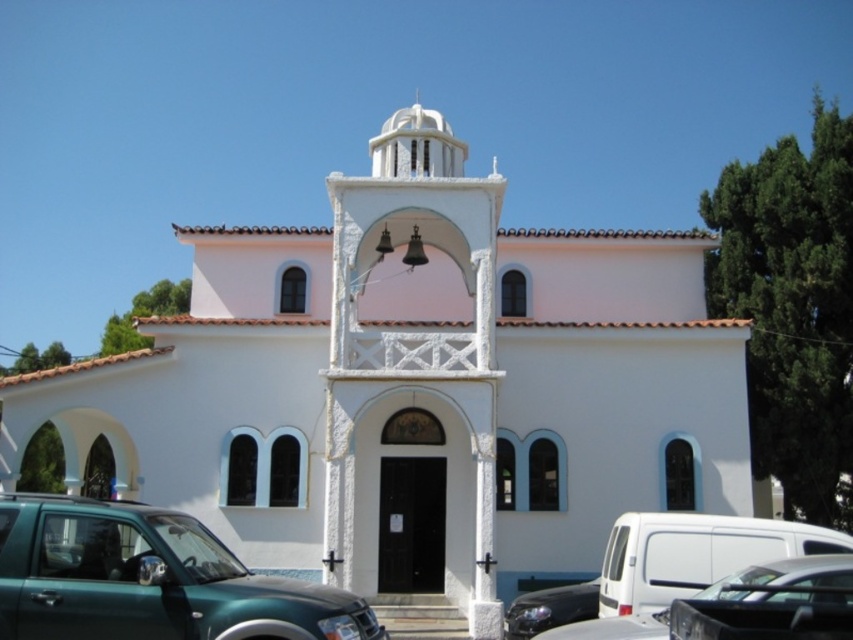
Looking at this image, can you confirm if green matte truck at lower left is positioned below black glossy car at lower right?

Yes, green matte truck at lower left is below black glossy car at lower right.

Based on the photo, who is lower down, green matte truck at lower left or black glossy car at lower right?

green matte truck at lower left

This screenshot has width=853, height=640. I want to click on green matte truck at lower left, so (x=148, y=579).

Find the location of a particular element. green matte truck at lower left is located at coordinates (148, 579).

The image size is (853, 640). Describe the element at coordinates (415, 342) in the screenshot. I see `white stone bell tower at center` at that location.

Is white stone bell tower at center closer to the viewer compared to black glossy car at lower right?

That is False.

Identify the location of white stone bell tower at center. This screenshot has height=640, width=853. (415, 342).

In order to click on white stone bell tower at center in this screenshot , I will do `click(415, 342)`.

Describe the element at coordinates (415, 342) in the screenshot. This screenshot has height=640, width=853. I see `white stone bell tower at center` at that location.

Does point (418, 186) come closer to viewer compared to point (178, 593)?

That is False.

Where is `white stone bell tower at center`? This screenshot has width=853, height=640. white stone bell tower at center is located at coordinates (415, 342).